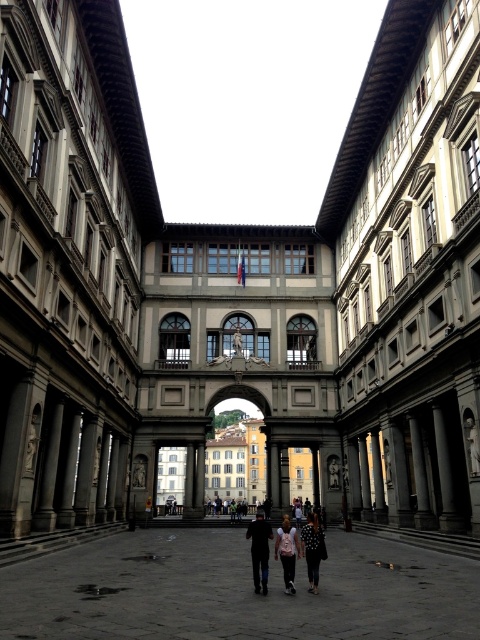
Between point (316, 554) and point (280, 541), which one is positioned in front?

Point (316, 554)

Does black dotted dress at center have a greater height compared to pink fabric dress at center?

Yes.

Locate an element on the screen. Image resolution: width=480 pixels, height=640 pixels. black dotted dress at center is located at coordinates (312, 548).

From the picture: Is dark blue jeans at center in front of black dotted dress at center?

No, it is behind black dotted dress at center.

Can you confirm if dark blue jeans at center is positioned below black dotted dress at center?

Incorrect, dark blue jeans at center is not positioned below black dotted dress at center.

Which is behind, point (256, 545) or point (312, 540)?

Positioned behind is point (256, 545).

Where is `dark blue jeans at center`? dark blue jeans at center is located at coordinates (260, 550).

Is dark gray stone courtyard at center to the left of dark blue jeans at center from the viewer's perspective?

Yes, dark gray stone courtyard at center is to the left of dark blue jeans at center.

Is dark gray stone courtyard at center below dark blue jeans at center?

No.

Does point (419, 564) come in front of point (265, 552)?

No, (419, 564) is behind (265, 552).

Identify the location of dark gray stone courtyard at center. This screenshot has width=480, height=640. (237, 592).